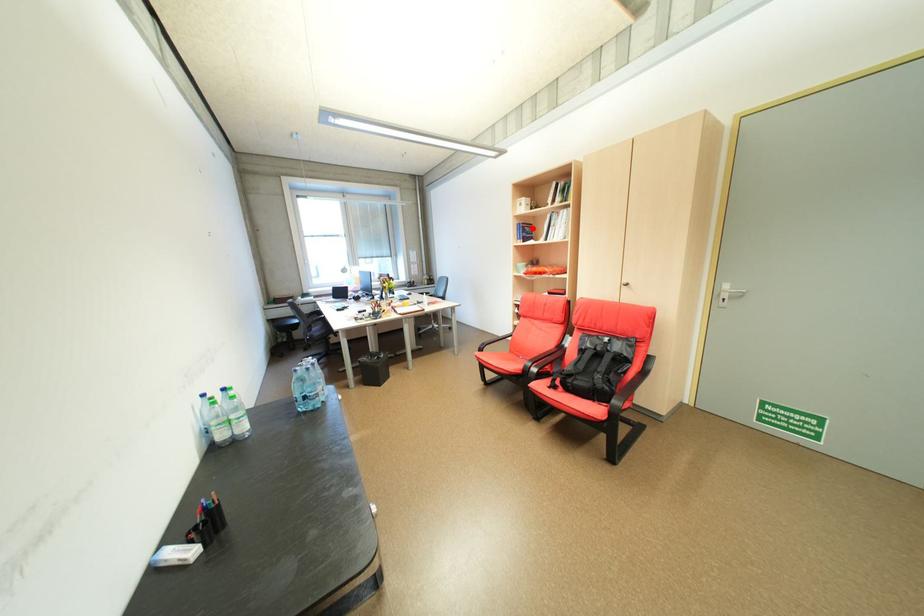
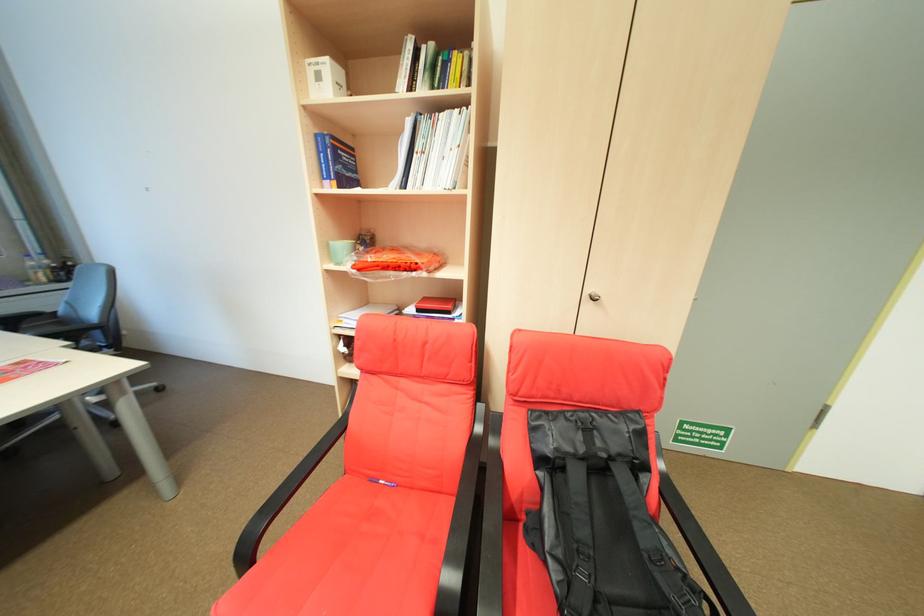
The point at the highlighted location is marked in the first image. Where is the corresponding point in the second image?

(344, 148)